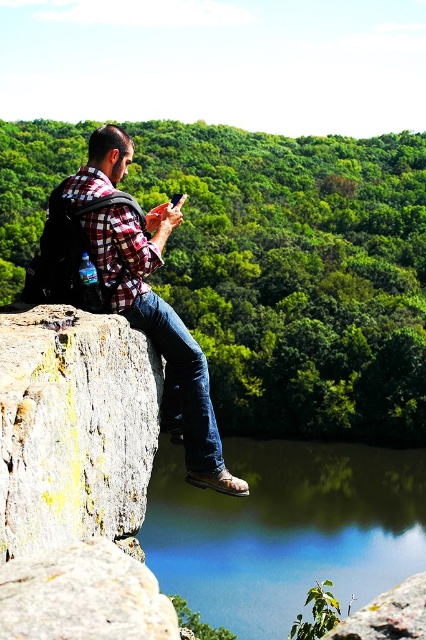
You are a hiker who has just reached the cliff edge. You see the green smooth water at lower center and the yellowish rock at left. Which object is positioned to the right side of the other?

The green smooth water at lower center is to the right of yellowish rock at left according to the description.

You are a hiker who wants to take a photo of the yellowish rock at left and the plaid fabric shirt at left. Which object should you zoom in more on to capture both in the frame?

You should zoom in more on the yellowish rock at left because it is smaller than the plaid fabric shirt at left, so it might be harder to see in the photo.

You are a drone operator who needs to capture a photo of the point at coordinates (354, 568) in the scene. The drone can only fly up to 130 meters away from its starting position. Based on the scene, can the drone reach the point?

The point at coordinates (354, 568) is 138.96 meters away from the camera. Since the drone can only fly up to 130 meters, it cannot reach the point.